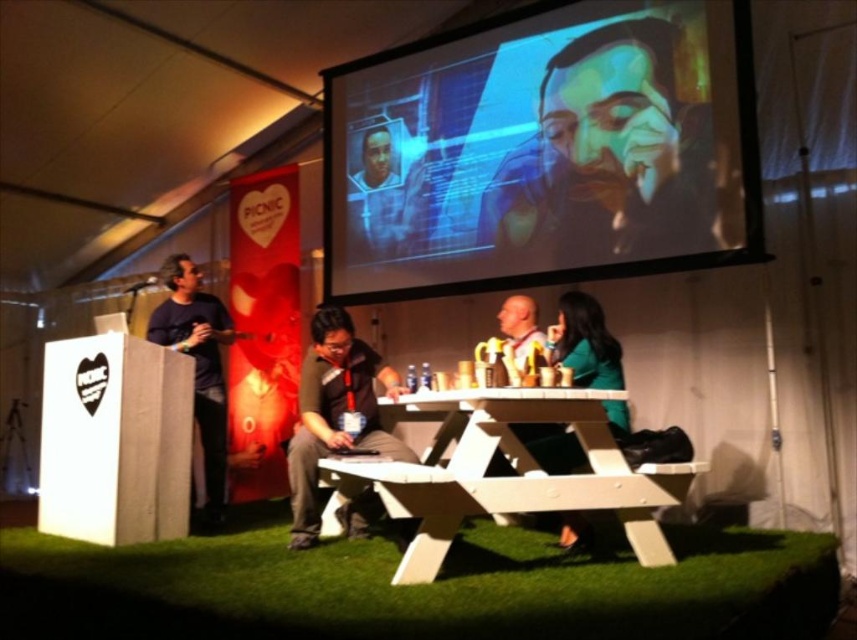
Question: Does matte plastic projection screen at upper center lie in front of white wood picnic table at center?

Choices:
 (A) yes
 (B) no

Answer: (B)

Question: Which object is farther from the camera taking this photo?

Choices:
 (A) white wood picnic table at center
 (B) dark blue shirt at left

Answer: (B)

Question: Does matte black jacket at center have a larger size compared to dark blue shirt at left?

Choices:
 (A) yes
 (B) no

Answer: (B)

Question: Which point is closer to the camera?

Choices:
 (A) (402, 448)
 (B) (225, 493)
 (C) (505, 406)
 (D) (409, 172)

Answer: (C)

Question: Does matte plastic projection screen at upper center have a greater width compared to dark blue shirt at left?

Choices:
 (A) no
 (B) yes

Answer: (B)

Question: Which object is the closest to the white wood picnic table at center?

Choices:
 (A) matte plastic projection screen at upper center
 (B) matte black jacket at center

Answer: (B)